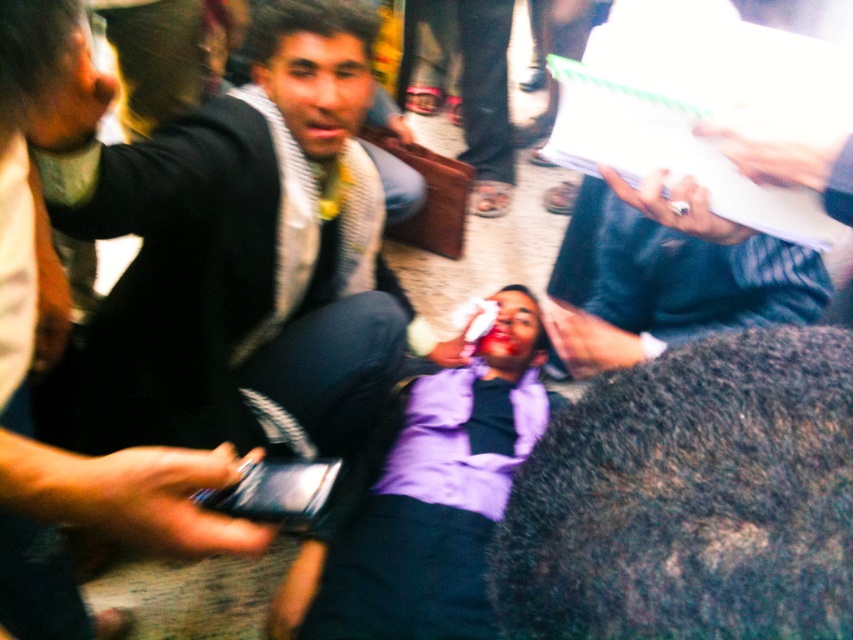
Consider the image. Can you confirm if matte black jacket at center is positioned to the left of white paper at upper right?

Correct, you'll find matte black jacket at center to the left of white paper at upper right.

Measure the distance from matte black jacket at center to white paper at upper right.

matte black jacket at center is 20.02 inches from white paper at upper right.

Image resolution: width=853 pixels, height=640 pixels. Describe the element at coordinates (242, 252) in the screenshot. I see `matte black jacket at center` at that location.

Image resolution: width=853 pixels, height=640 pixels. Find the location of `matte black jacket at center`. matte black jacket at center is located at coordinates (242, 252).